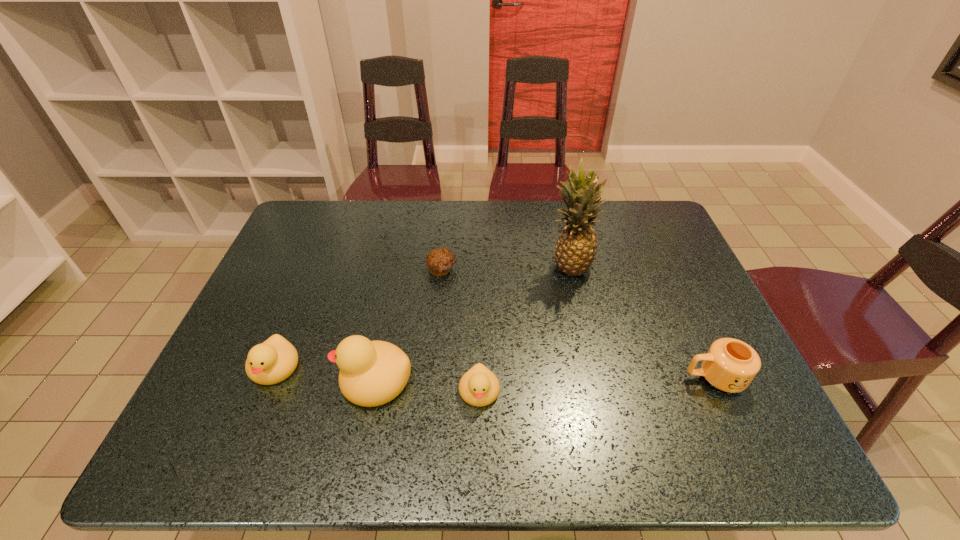
The width and height of the screenshot is (960, 540). In order to click on free point that keeps the ducklings evenly spaced on the right in this screenshot , I will do `click(589, 404)`.